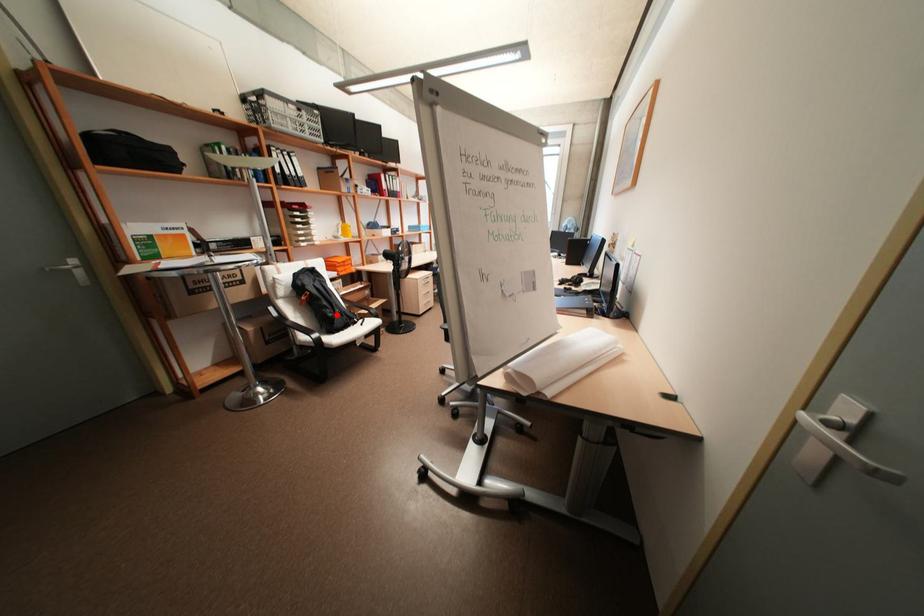
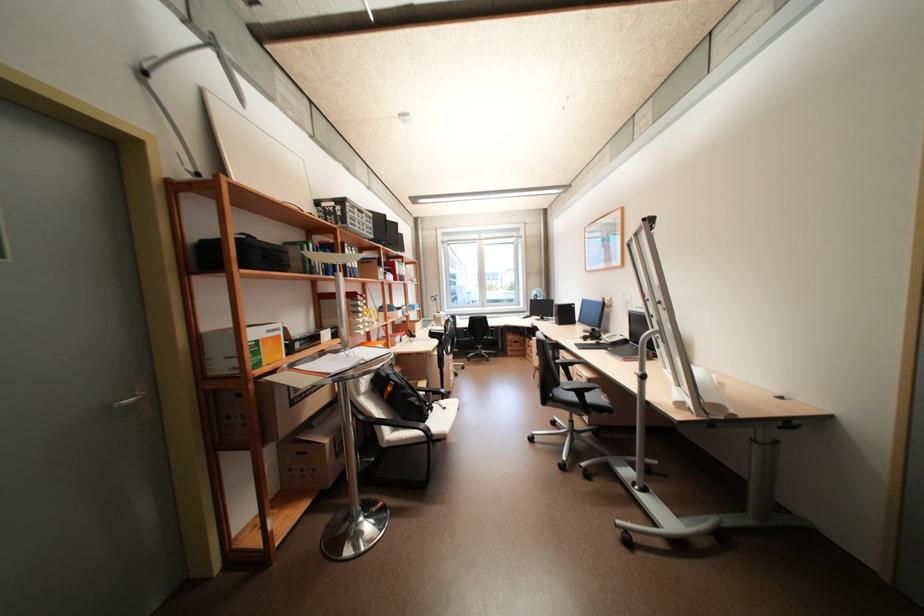
Find the pixel in the second image that matches the highlighted location in the first image.

(423, 403)